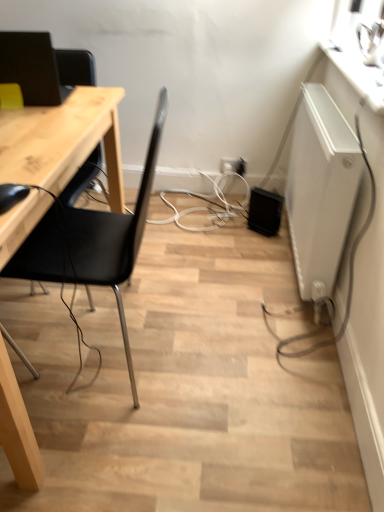
Question: From a real-world perspective, is matte black monitor at upper left over black matte chair at left?

Choices:
 (A) no
 (B) yes

Answer: (B)

Question: Is matte black monitor at upper left facing away from black matte chair at left?

Choices:
 (A) no
 (B) yes

Answer: (B)

Question: Is the depth of matte black monitor at upper left greater than that of black matte chair at left?

Choices:
 (A) no
 (B) yes

Answer: (B)

Question: Is matte black monitor at upper left taller than black matte chair at left?

Choices:
 (A) yes
 (B) no

Answer: (B)

Question: Considering the relative sizes of matte black monitor at upper left and black matte chair at left in the image provided, is matte black monitor at upper left bigger than black matte chair at left?

Choices:
 (A) no
 (B) yes

Answer: (A)

Question: Does point (46, 60) appear closer or farther from the camera than point (375, 101)?

Choices:
 (A) farther
 (B) closer

Answer: (A)

Question: Relative to white glossy counter top at upper right, is matte black monitor at upper left in front or behind?

Choices:
 (A) behind
 (B) front

Answer: (A)

Question: From a real-world perspective, is matte black monitor at upper left physically located above or below white glossy counter top at upper right?

Choices:
 (A) above
 (B) below

Answer: (A)

Question: Considering the positions of matte black monitor at upper left and white glossy counter top at upper right in the image, is matte black monitor at upper left wider or thinner than white glossy counter top at upper right?

Choices:
 (A) thin
 (B) wide

Answer: (B)

Question: From a real-world perspective, is white matte radiator at right positioned above or below black matte chair at left?

Choices:
 (A) below
 (B) above

Answer: (A)

Question: In the image, is white matte radiator at right positioned in front of or behind black matte chair at left?

Choices:
 (A) behind
 (B) front

Answer: (A)

Question: From the image's perspective, relative to black matte chair at left, is white matte radiator at right above or below?

Choices:
 (A) above
 (B) below

Answer: (A)

Question: Looking at their shapes, would you say white matte radiator at right is wider or thinner than black matte chair at left?

Choices:
 (A) thin
 (B) wide

Answer: (A)

Question: Is point (369, 94) closer or farther from the camera than point (221, 169)?

Choices:
 (A) closer
 (B) farther

Answer: (A)

Question: In terms of height, does white glossy counter top at upper right look taller or shorter compared to white plastic electric outlet at center, the 2th electric outlet from the right?

Choices:
 (A) tall
 (B) short

Answer: (A)